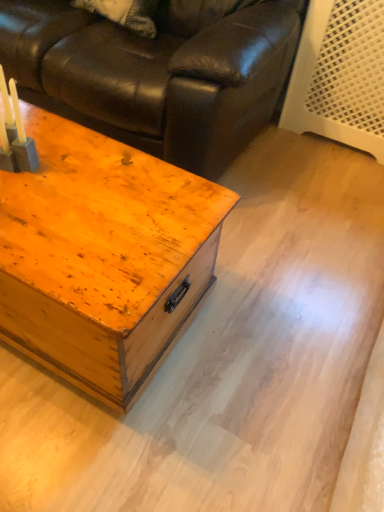
This screenshot has height=512, width=384. I want to click on empty space that is ontop of wooden trunk at center, so click(79, 194).